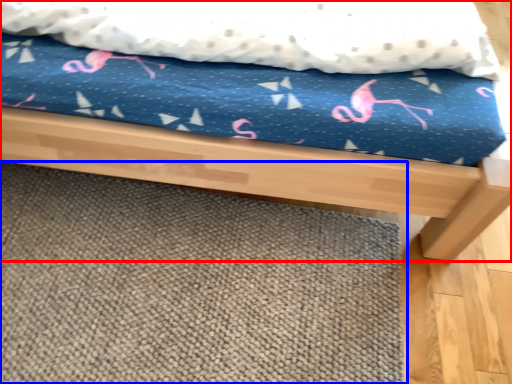
Question: Which of the following is the farthest to the observer, bed (highlighted by a red box) or mat (highlighted by a blue box)?

Choices:
 (A) bed
 (B) mat

Answer: (B)